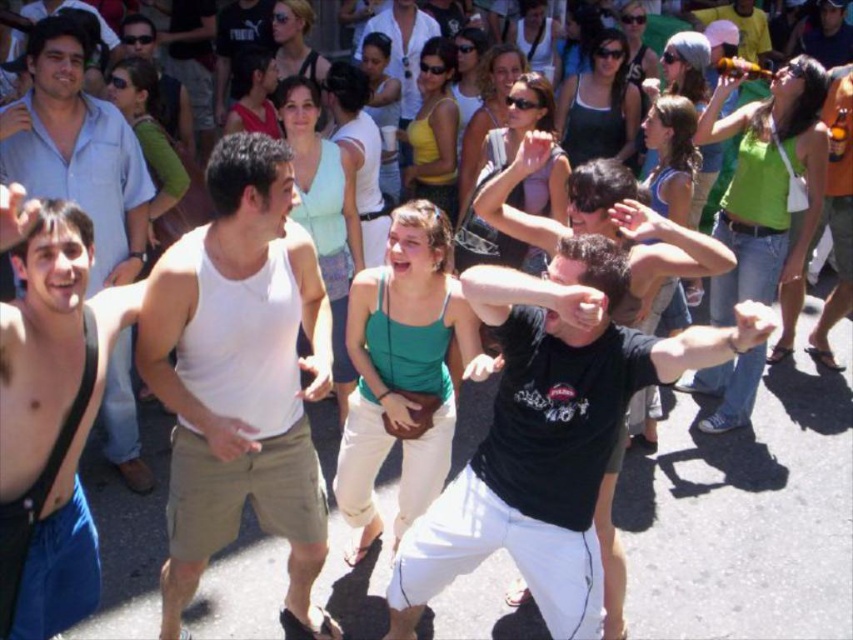
You are standing in the crowd at the festival and want to take a photo of both the man in the black Tshirt and white pants and the woman in the green tank top. The man is at point [180,332] and the woman is at point [32,113]. Which person will appear larger in your photo?

The man in the black Tshirt and white pants at point [180,332] will appear larger in the photo because he is closer to the camera than the woman at point [32,113].

Consider the image. You are a photographer standing at the back of the crowd. You want to take a photo of both the white cotton tank top at center and the shiny blue shirt at left. The minimum distance your camera can focus on two objects is 5 feet. Will both shirts be in focus?

The distance between the white cotton tank top at center and the shiny blue shirt at left is 5.07 feet, which exceeds the camera minimum focus distance of 5 feet. Therefore, both shirts will not be in focus.